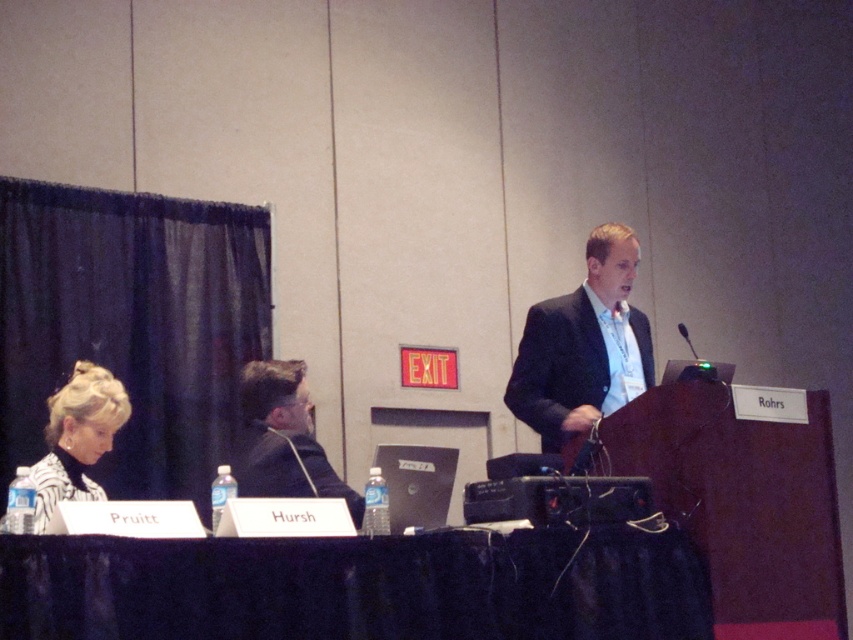
You are an event organizer who needs to adjust the microphone height for better visibility. Given the black fabric table at lower center and the black plastic microphone at upper center, which object is taller and requires lowering?

The black fabric table at lower center is much taller than the black plastic microphone at upper center. Therefore, the black fabric table at lower center needs to be lowered to ensure the microphone is at an appropriate height.

You are organizing a virtual meeting and need to ensure that the black fabric table at lower center and the black plastic microphone at upper center are visible to all participants. Based on their positions, which object should be placed closer to the camera to ensure both are clearly visible?

The black plastic microphone at upper center should be placed closer to the camera since the black fabric table at lower center is positioned on the left side of it, meaning the microphone is further away and might be less visible. Moving it closer ensures both objects remain in focus.

You are an event organizer setting up for a meeting. You need to place a new nameplate for a guest between the existing Pruitt and Hursh nameplates on the black fabric table at lower center. According to the table layout, where should you position the new nameplate?

The black fabric table at lower center is positioned at coordinates point (357, 586), so place the new nameplate between Pruitt and Hursh nameplates on the table.